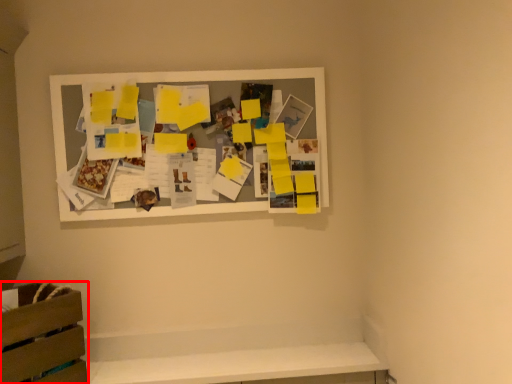
Question: Where is furniture (annotated by the red box) located in relation to picture frame in the image?

Choices:
 (A) left
 (B) right

Answer: (A)